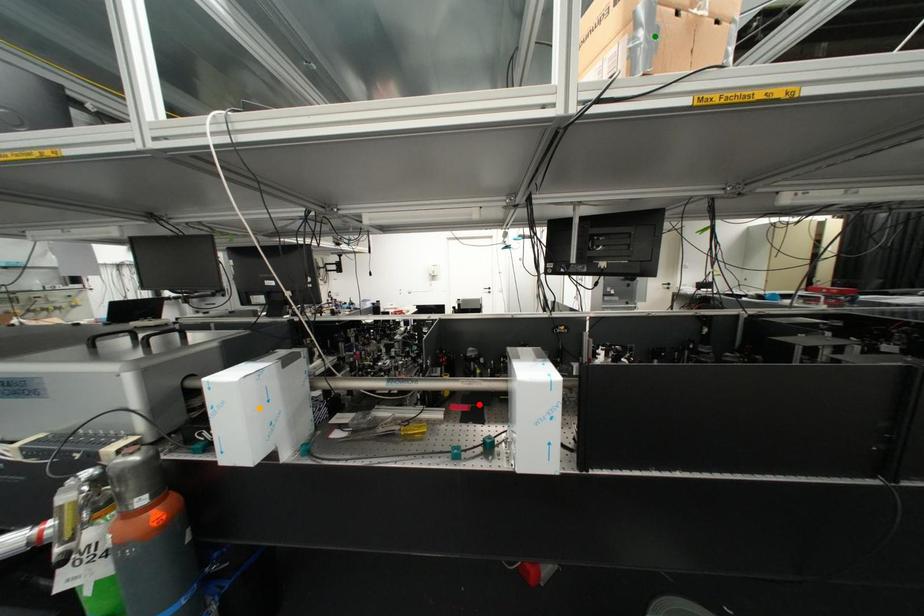
Order these from nearest to farthest:
- green point
- red point
- orange point

green point → orange point → red point